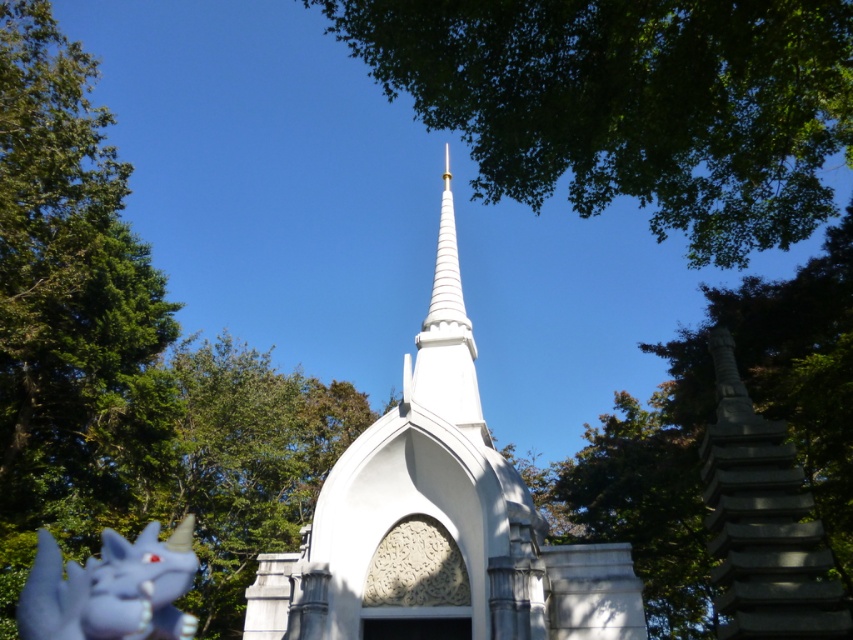
You are planning to take a photo of the white stone church at center and the white glossy spire at center from a distance. Which object should you focus on first if you want to capture both in a single frame without zooming in? Please explain your reasoning based on their sizes.

A: The white stone church at center is wider than the white glossy spire at center. Therefore, you should focus on the white stone church at center first to ensure it fits within the frame, as it is wider and requires more space. The spire, being narrower, will naturally fit alongside it without needing additional zoom.

You are standing in front of the white Gothic structure and notice two points marked on the image. The first point is at coordinates point (566, 104) and the second is at point (553, 573). Which of these points is nearer to you?

Point (566, 104) is closer to the viewer than point (553, 573).

You are standing in the outdoor area near the white architectural structure. You see the matte purple dragon at lower left and the white glossy spire at center. Which object is positioned closer to you?

The matte purple dragon at lower left is closer to the viewer than the white glossy spire at center.